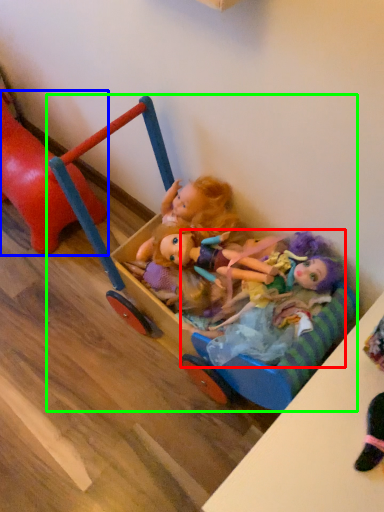
Question: Considering the real-world distances, which object is closest to doll (highlighted by a red box)? toy (highlighted by a blue box) or toy (highlighted by a green box).

Choices:
 (A) toy
 (B) toy

Answer: (B)